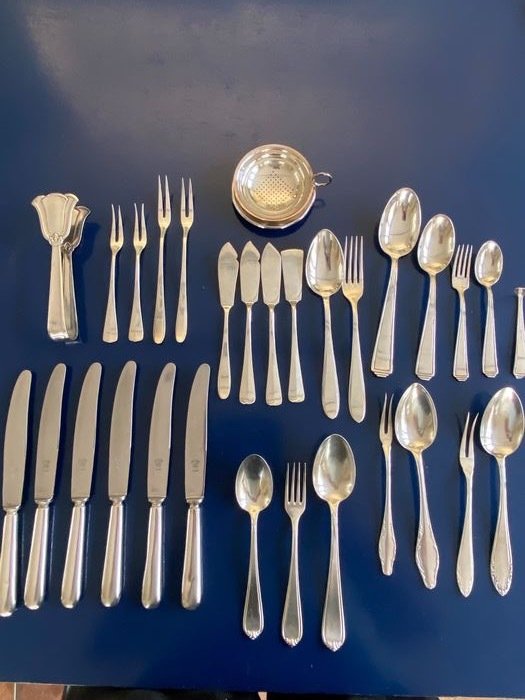
Where is `spoon`? Image resolution: width=525 pixels, height=700 pixels. spoon is located at coordinates (328, 295), (395, 245), (432, 270), (491, 276), (499, 453), (414, 442), (335, 509), (257, 511).